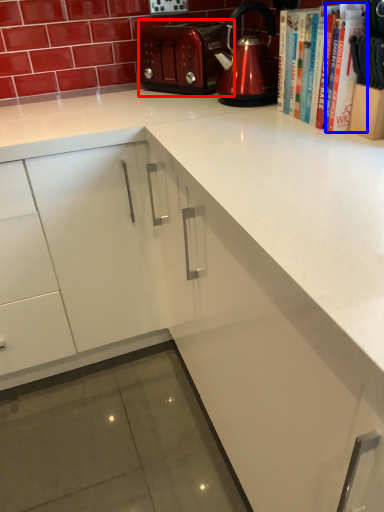
Question: Which of the following is the farthest to the observer, toaster (highlighted by a red box) or book (highlighted by a blue box)?

Choices:
 (A) toaster
 (B) book

Answer: (A)